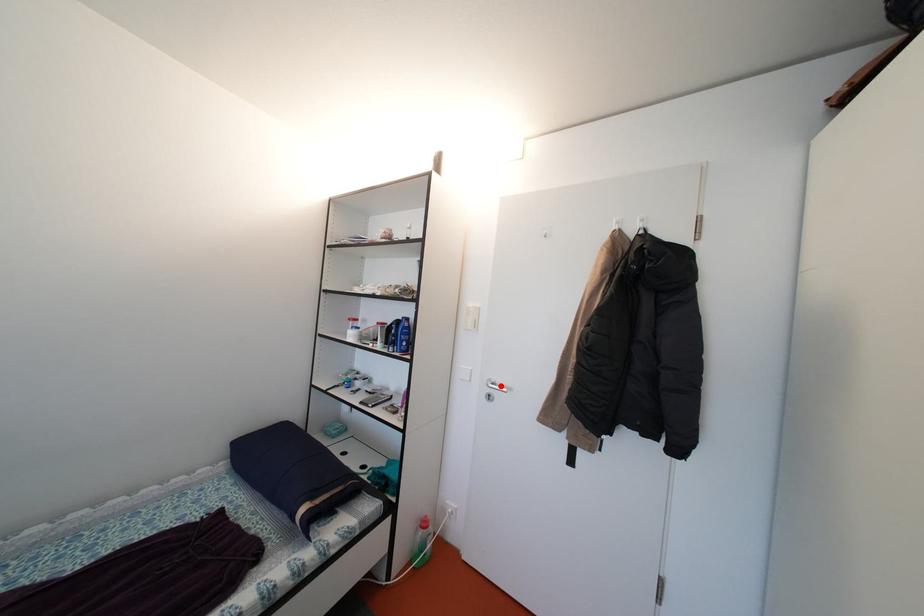
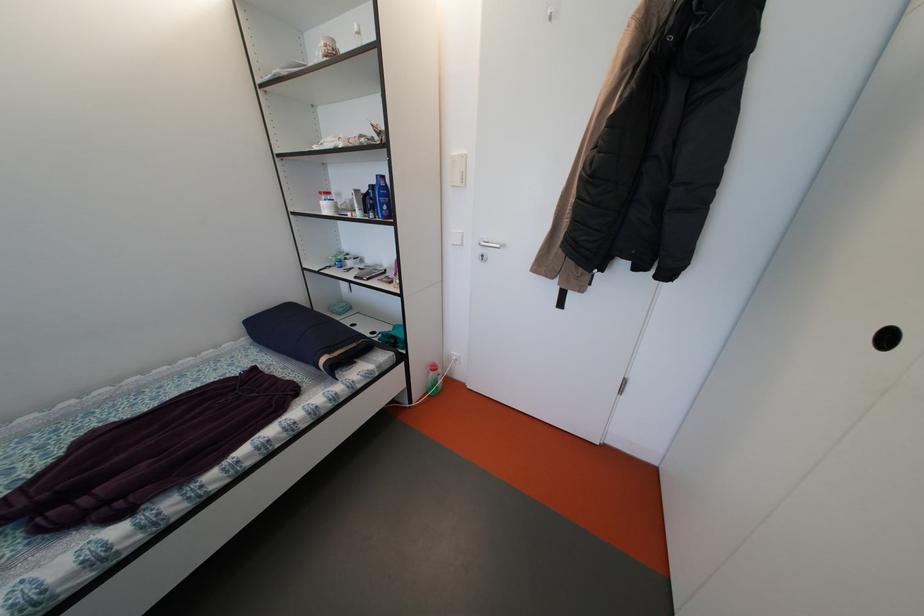
In the second image, find the point that corresponds to the highlighted location in the first image.

(493, 245)